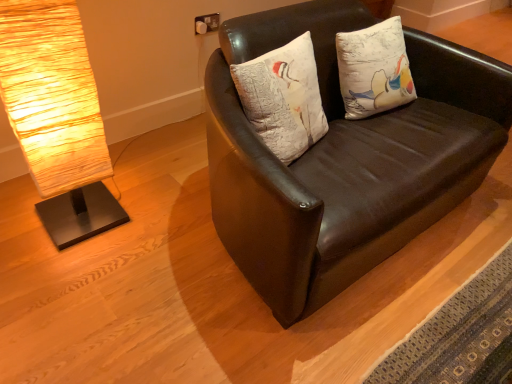
The height and width of the screenshot is (384, 512). In order to click on vacant space to the left of matte brown leather couch at center in this screenshot , I will do `click(130, 222)`.